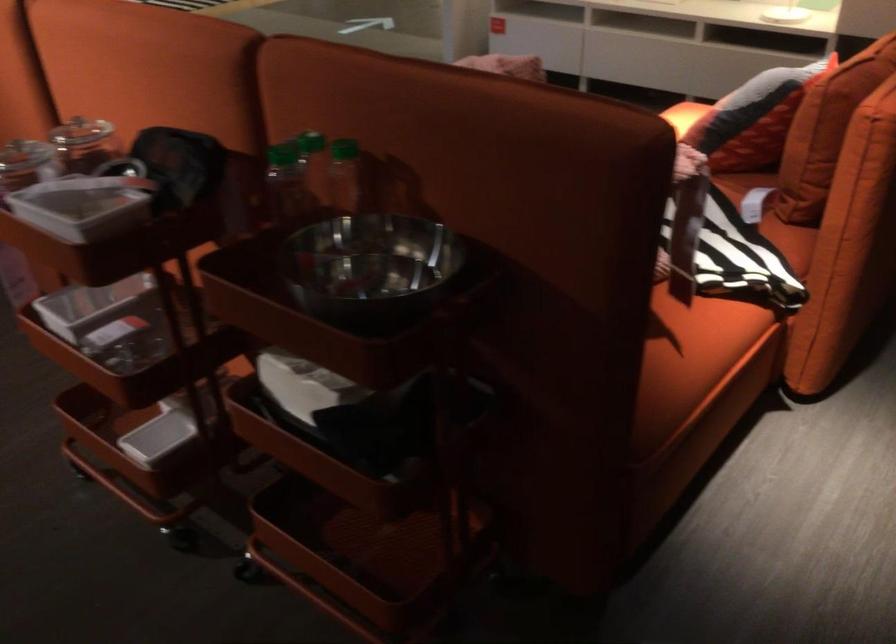
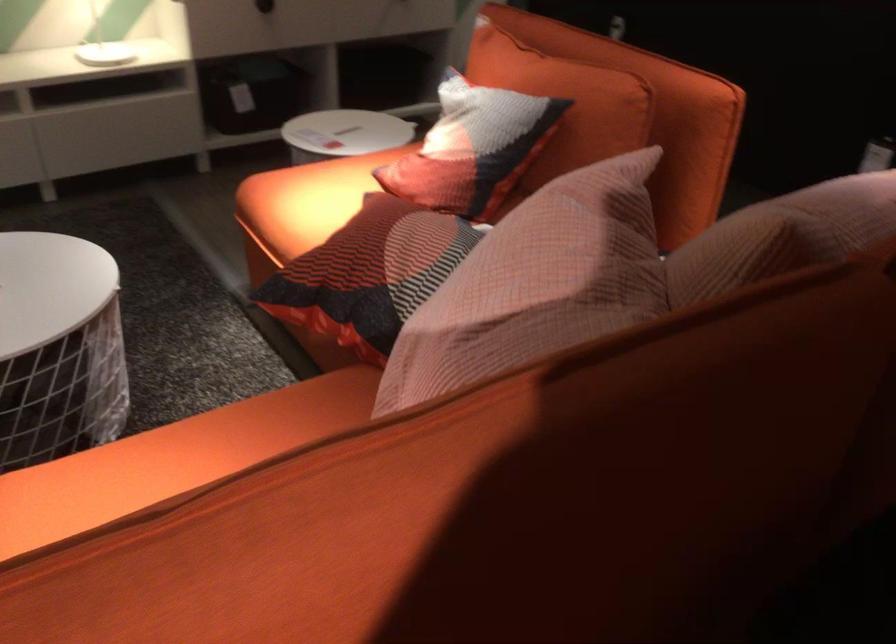
The point at (784, 75) is marked in the first image. Where is the corresponding point in the second image?

(564, 102)